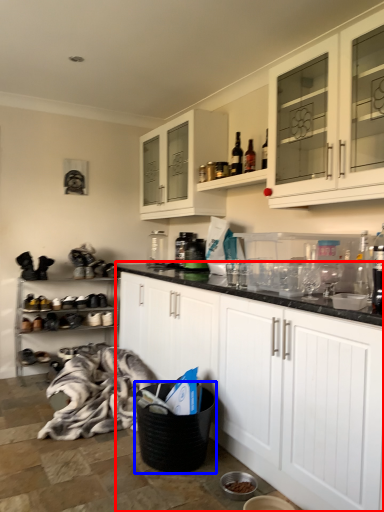
Question: Which of the following is the farthest to the observer, cabinetry (highlighted by a red box) or laundry basket (highlighted by a blue box)?

Choices:
 (A) cabinetry
 (B) laundry basket

Answer: (B)